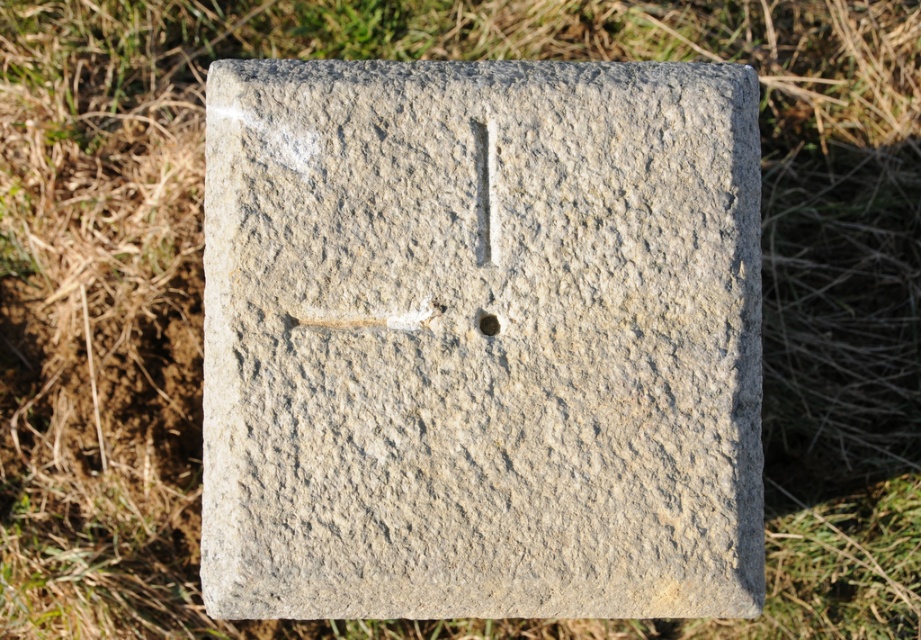
Does gray stone gravestone at center have a greater height compared to black stone hole at center?

Indeed, gray stone gravestone at center has a greater height compared to black stone hole at center.

Does gray stone gravestone at center have a greater width compared to black stone hole at center?

Yes, gray stone gravestone at center is wider than black stone hole at center.

I want to click on gray stone gravestone at center, so click(481, 340).